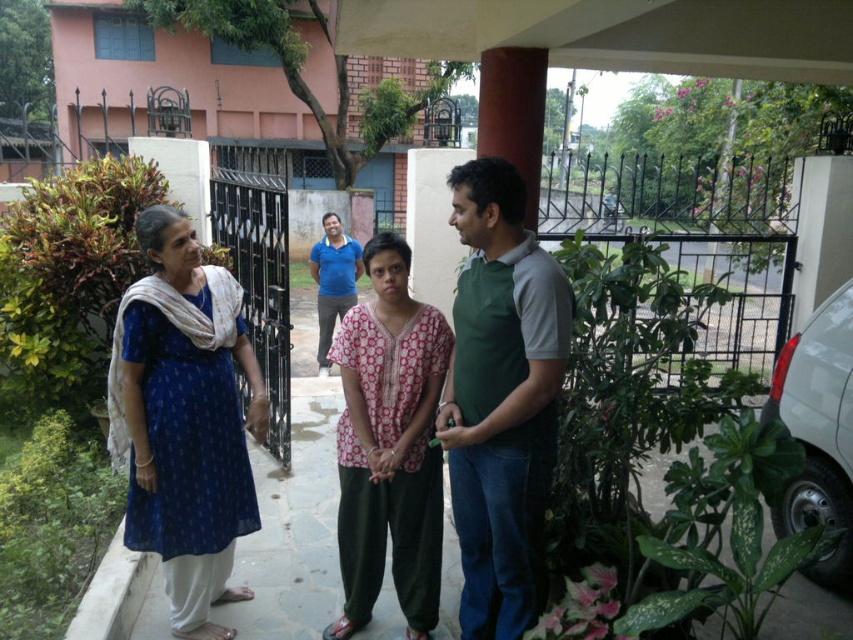
Question: Does blue printed dress at left appear on the left side of blue cotton shirt at center?

Choices:
 (A) no
 (B) yes

Answer: (A)

Question: Which point appears farthest from the camera in this image?

Choices:
 (A) (175, 333)
 (B) (335, 212)

Answer: (B)

Question: Does blue printed dress at left come behind blue cotton shirt at center?

Choices:
 (A) no
 (B) yes

Answer: (A)

Question: Which of the following is the closest to the observer?

Choices:
 (A) (328, 627)
 (B) (126, 538)
 (C) (491, 477)

Answer: (C)

Question: Is green cotton shirt at center to the left of blue cotton shirt at center from the viewer's perspective?

Choices:
 (A) no
 (B) yes

Answer: (A)

Question: Which point appears farthest from the camera in this image?

Choices:
 (A) (381, 268)
 (B) (393, 483)
 (C) (532, 504)
 (D) (123, 330)

Answer: (B)